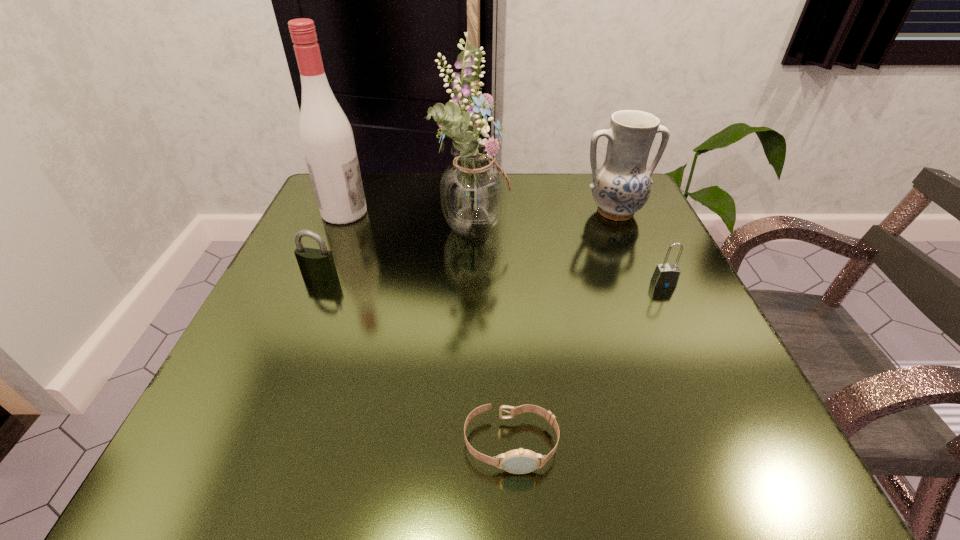
Find the location of `empty location between the pottery and the nearest object`. empty location between the pottery and the nearest object is located at coordinates (563, 328).

What are the coordinates of `empty location between the right padlock and the left padlock` in the screenshot? It's located at (492, 280).

This screenshot has height=540, width=960. I want to click on vacant area between the nearest object and the alcohol, so click(427, 328).

Image resolution: width=960 pixels, height=540 pixels. Identify the location of free space between the shortest object and the third tallest object. (563, 328).

At what (x,y) coordinates should I click in order to perform the action: click on vacant point located between the bouquet and the shortest object. Please return your answer as a coordinate pair (x, y). The image size is (960, 540). Looking at the image, I should click on (492, 334).

Where is `unoccupied area between the shortest object and the left padlock`? The height and width of the screenshot is (540, 960). unoccupied area between the shortest object and the left padlock is located at coordinates (416, 360).

You are a GUI agent. You are given a task and a screenshot of the screen. Output one action in this format:
    pyautogui.click(x=<x>, y=<y>)
    Task: Click on the free space between the shortest object and the left padlock
    Image resolution: width=960 pixels, height=540 pixels.
    Given the screenshot: What is the action you would take?
    pyautogui.click(x=416, y=360)

Image resolution: width=960 pixels, height=540 pixels. I want to click on vacant area between the bouquet and the left padlock, so click(x=397, y=249).

Select which object is the second closest to the alcohol. Please provide its 2D coordinates. Your answer should be formatted as a tuple, i.e. [(x, y)], where the tuple contains the x and y coordinates of a point satisfying the conditions above.

[(473, 189)]

Identify which object is the fourth closest to the right padlock. Please provide its 2D coordinates. Your answer should be formatted as a tuple, i.e. [(x, y)], where the tuple contains the x and y coordinates of a point satisfying the conditions above.

[(318, 264)]